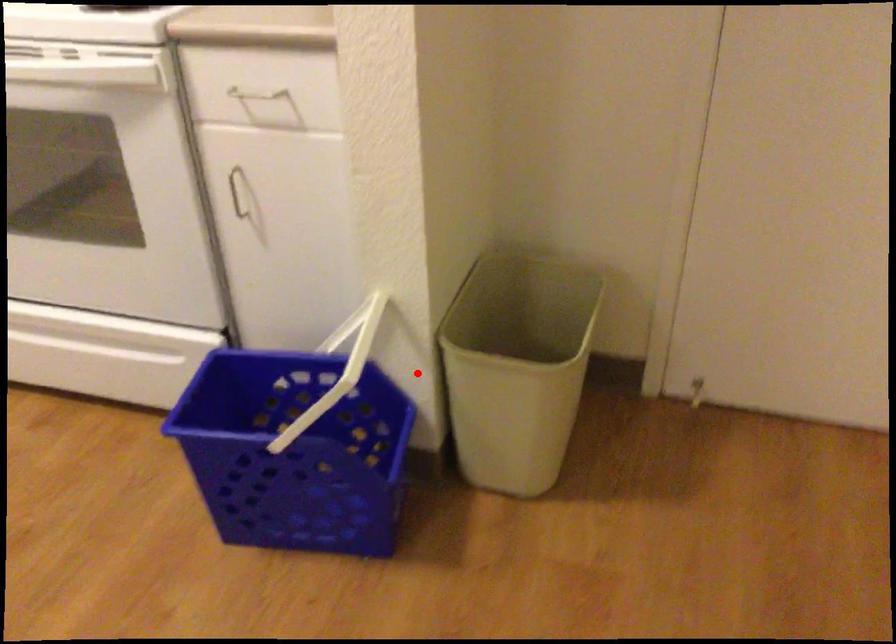
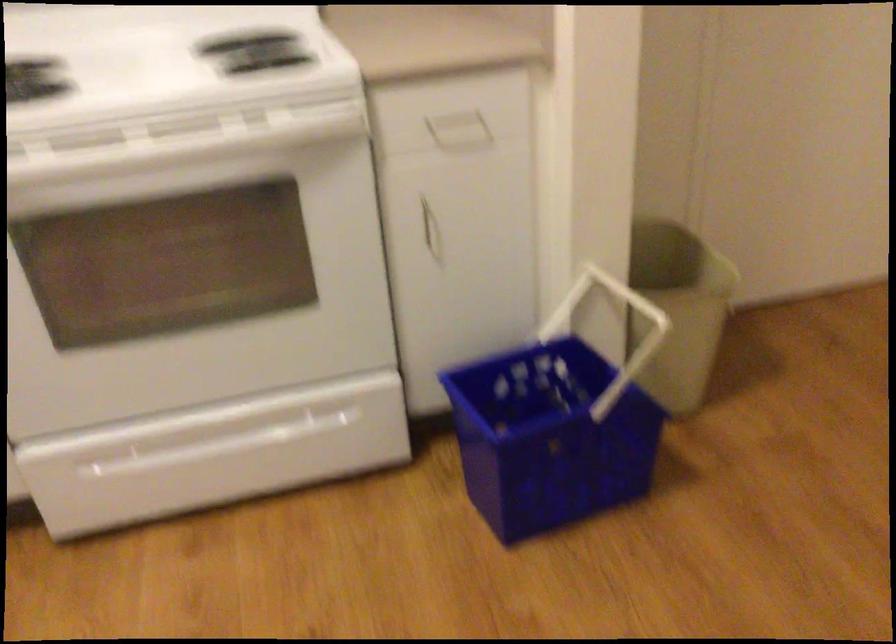
Question: I am providing you with two images of the same scene from different viewpoints. In image1, a red point is highlighted. Considering the same 3D point in image2, which of the following is correct?

Choices:
 (A) It is closer
 (B) It is farther

Answer: (B)